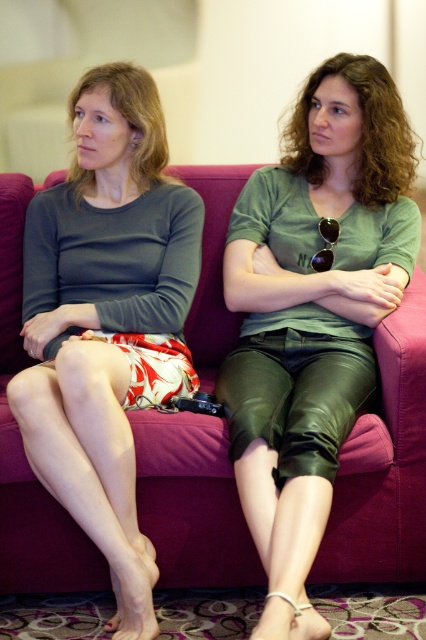
Looking at this image, which of these two, green leather pants at center or matte gray skirt at left, stands taller?

matte gray skirt at left is taller.

Is point (339, 400) positioned after point (52, 365)?

No, (339, 400) is closer to viewer.

Measure the distance between point (x=336, y=339) and camera.

A distance of 2.04 meters exists between point (x=336, y=339) and camera.

Where is `green leather pants at center`? Image resolution: width=426 pixels, height=640 pixels. green leather pants at center is located at coordinates (313, 314).

Can you confirm if matte gray skirt at left is thinner than magenta fabric couch at center?

Correct, matte gray skirt at left's width is less than magenta fabric couch at center's.

Is matte gray skirt at left below magenta fabric couch at center?

No.

I want to click on matte gray skirt at left, so click(106, 320).

Does point (290, 150) come farther from viewer compared to point (198, 365)?

No, (290, 150) is in front of (198, 365).

Between green leather pants at center and magenta fabric couch at center, which one appears on the left side from the viewer's perspective?

magenta fabric couch at center

Measure the distance between green leather pants at center and camera.

5.11 feet

What are the coordinates of `green leather pants at center` in the screenshot? It's located at (313, 314).